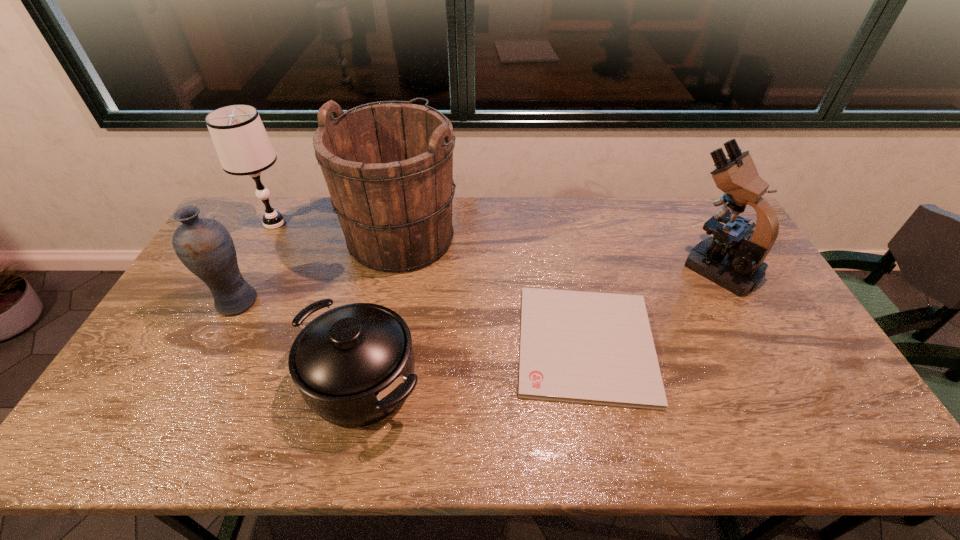
Locate an element on the screen. free space at the far edge of the desktop is located at coordinates (490, 212).

The width and height of the screenshot is (960, 540). Identify the location of free space at the near edge. (558, 426).

You are a GUI agent. You are given a task and a screenshot of the screen. Output one action in this format:
    pyautogui.click(x=<x>, y=<y>)
    Task: Click on the vacant area at the left edge
    
    Given the screenshot: What is the action you would take?
    pyautogui.click(x=179, y=355)

The width and height of the screenshot is (960, 540). In order to click on vacant region at the near left corner of the desktop in this screenshot , I will do `click(126, 421)`.

Find the location of `vacant space at the near right corner of the desktop`. vacant space at the near right corner of the desktop is located at coordinates (863, 429).

Find the location of a particular element. Image resolution: width=960 pixels, height=540 pixels. vacant space that's between the table lamp and the rightmost object is located at coordinates (496, 245).

Where is `vacant region between the microscope and the vase`? This screenshot has height=540, width=960. vacant region between the microscope and the vase is located at coordinates [477, 284].

You are a GUI agent. You are given a task and a screenshot of the screen. Output one action in this format:
    pyautogui.click(x=<x>, y=<y>)
    Task: Click on the free space between the bucket and the clipboard
    The height and width of the screenshot is (540, 960).
    Given the screenshot: What is the action you would take?
    pyautogui.click(x=493, y=290)

Identify the location of empty space that is in between the clipboard and the table lamp. (430, 284).

The width and height of the screenshot is (960, 540). I want to click on vacant point located between the shortest object and the fifth tallest object, so click(x=474, y=363).